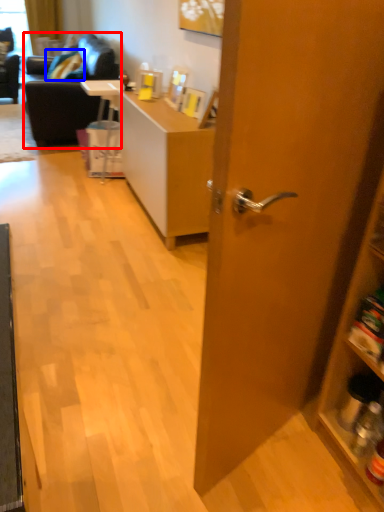
Question: Which of the following is the closest to the observer, studio couch (highlighted by a red box) or pillow (highlighted by a blue box)?

Choices:
 (A) studio couch
 (B) pillow

Answer: (A)